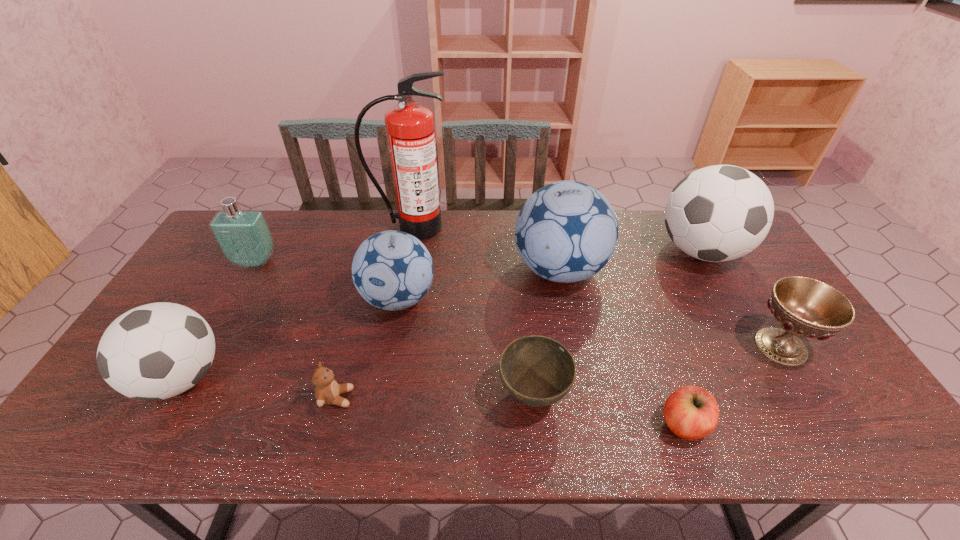
The image size is (960, 540). I want to click on bowl positioned at the near edge, so click(x=537, y=371).

Identify the location of teddy bear that is at the near edge. (327, 391).

Where is `apple at the near edge`? The height and width of the screenshot is (540, 960). apple at the near edge is located at coordinates (691, 412).

Find the location of `perfume present at the left edge`. perfume present at the left edge is located at coordinates (243, 236).

Where is `soccer ball that is at the left edge`? soccer ball that is at the left edge is located at coordinates (156, 351).

The height and width of the screenshot is (540, 960). Identify the location of soccer ball that is at the right edge. (718, 213).

This screenshot has height=540, width=960. Identify the location of chalice that is at the right edge. (804, 307).

Identify the location of object located at the near left corner. (156, 351).

This screenshot has height=540, width=960. In order to click on object that is at the far right corner in this screenshot , I will do `click(718, 213)`.

Identify the location of free space at the far edge. (638, 224).